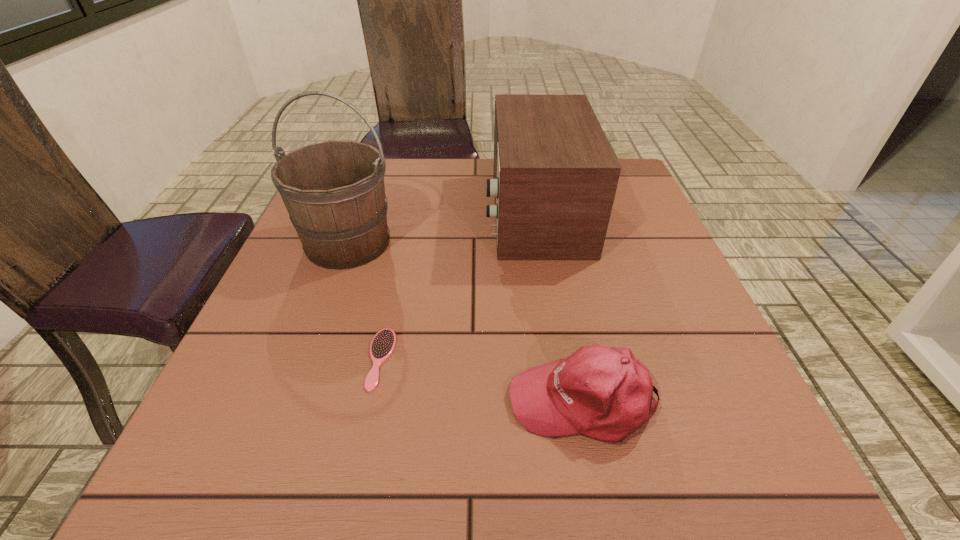
The image size is (960, 540). I want to click on bucket, so click(x=334, y=192).

Locate an element on the screen. Image resolution: width=960 pixels, height=540 pixels. the second tallest object is located at coordinates (555, 174).

This screenshot has height=540, width=960. I want to click on the third tallest object, so pyautogui.click(x=604, y=393).

Where is `the shortest object`? The height and width of the screenshot is (540, 960). the shortest object is located at coordinates (383, 343).

At what (x,y) coordinates should I click in order to perform the action: click on vacant space situated 0.190m on the front of the bucket. Please return your answer as a coordinate pair (x, y). Looking at the image, I should click on (311, 345).

Identify the location of vacant space located 0.310m on the front-facing side of the radio receiver. click(363, 213).

At what (x,y) coordinates should I click in order to perform the action: click on free spot located 0.130m on the front-facing side of the radio receiver. Please return your answer as a coordinate pair (x, y). The image size is (960, 540). Looking at the image, I should click on (434, 213).

Where is `free point located 0.060m on the front-facing side of the radio receiver`? This screenshot has height=540, width=960. free point located 0.060m on the front-facing side of the radio receiver is located at coordinates (462, 213).

This screenshot has height=540, width=960. I want to click on vacant region located 0.120m at the front of the baseball cap with the brim, so click(435, 402).

Locate an element on the screen. free region located 0.080m at the front of the baseball cap with the brim is located at coordinates (459, 402).